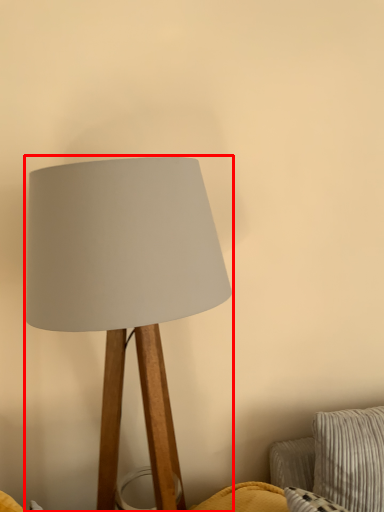
Question: Considering the relative positions of lamp (annotated by the red box) and pillow in the image provided, where is lamp (annotated by the red box) located with respect to the staircase?

Choices:
 (A) right
 (B) left

Answer: (B)